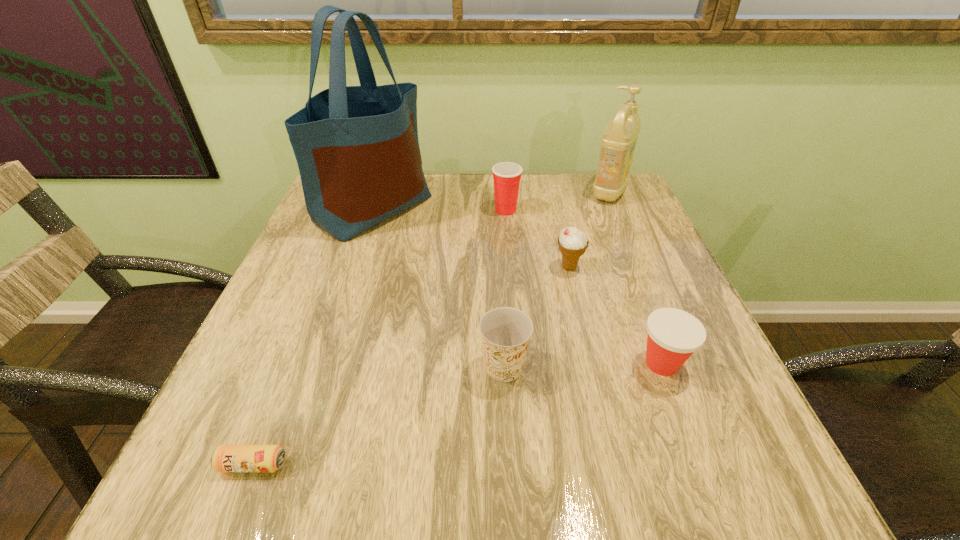
You are a GUI agent. You are given a task and a screenshot of the screen. Output one action in this format:
    pyautogui.click(x=<x>, y=<y>)
    Task: Click on the Dixie cup that is the second nearest to the shortest object
    The height and width of the screenshot is (540, 960).
    Given the screenshot: What is the action you would take?
    [673, 335]

What are the coordinates of `vacant position in the image that satisfies the following two spatial constraints: 1. on the front side of the rightmost Dixie cup; 2. on the right side of the handbag` in the screenshot? It's located at (322, 363).

I want to click on free space that satisfies the following two spatial constraints: 1. on the front side of the farthest Dixie cup; 2. on the right side of the fourth farthest object, so click(x=510, y=267).